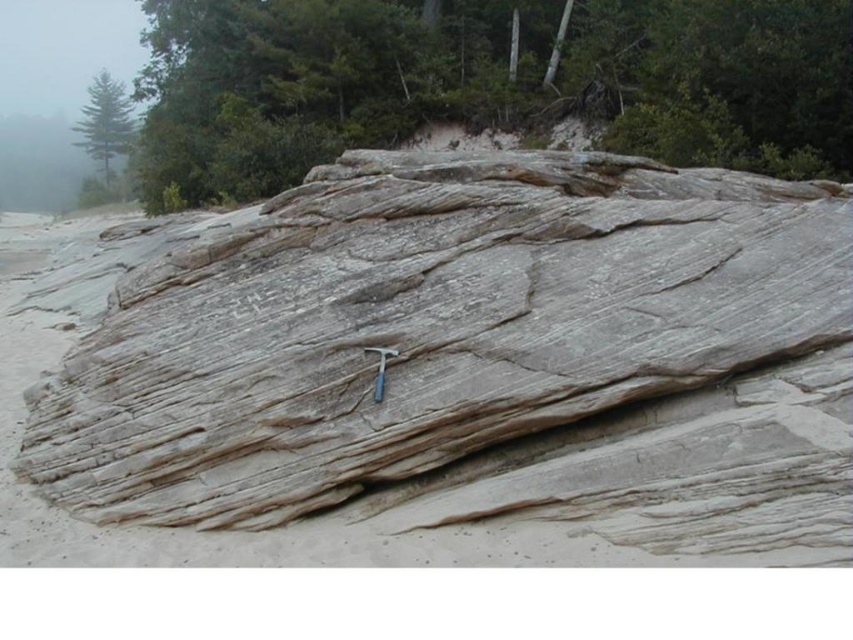
Question: Which object is the farthest from the gray/weathered rock at center?

Choices:
 (A) smooth brown tree trunk at upper center
 (B) green matte tree at upper left

Answer: (B)

Question: Which point is closer to the camera?

Choices:
 (A) (723, 156)
 (B) (90, 348)

Answer: (B)

Question: Is smooth brown tree trunk at upper center closer to camera compared to green matte tree at upper left?

Choices:
 (A) no
 (B) yes

Answer: (B)

Question: Estimate the real-world distances between objects in this image. Which object is farther from the gray/weathered rock at center?

Choices:
 (A) green matte tree at upper left
 (B) smooth brown tree trunk at upper center

Answer: (A)

Question: Does gray/weathered rock at center have a larger size compared to green matte tree at upper left?

Choices:
 (A) yes
 (B) no

Answer: (B)

Question: Can you confirm if smooth brown tree trunk at upper center is wider than green matte tree at upper left?

Choices:
 (A) no
 (B) yes

Answer: (B)